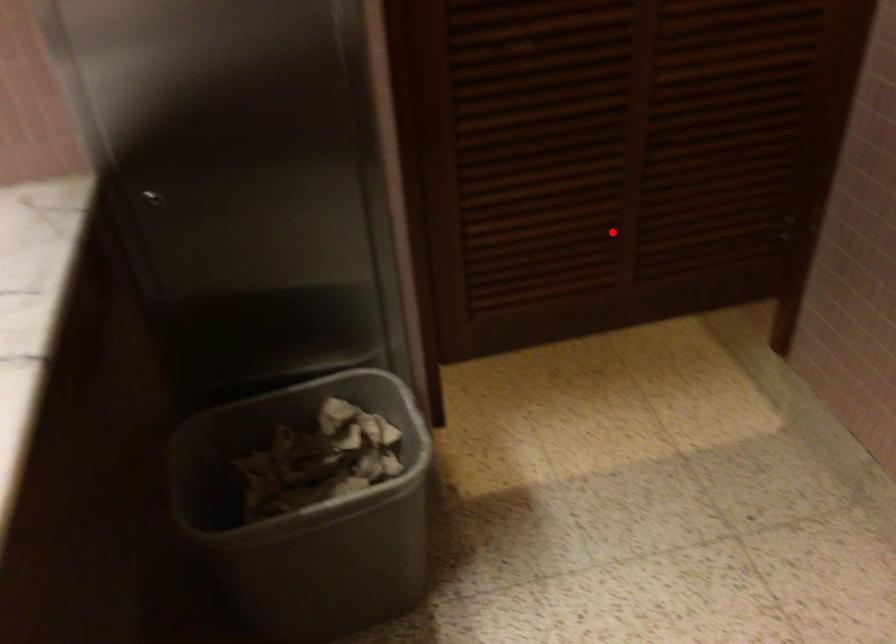
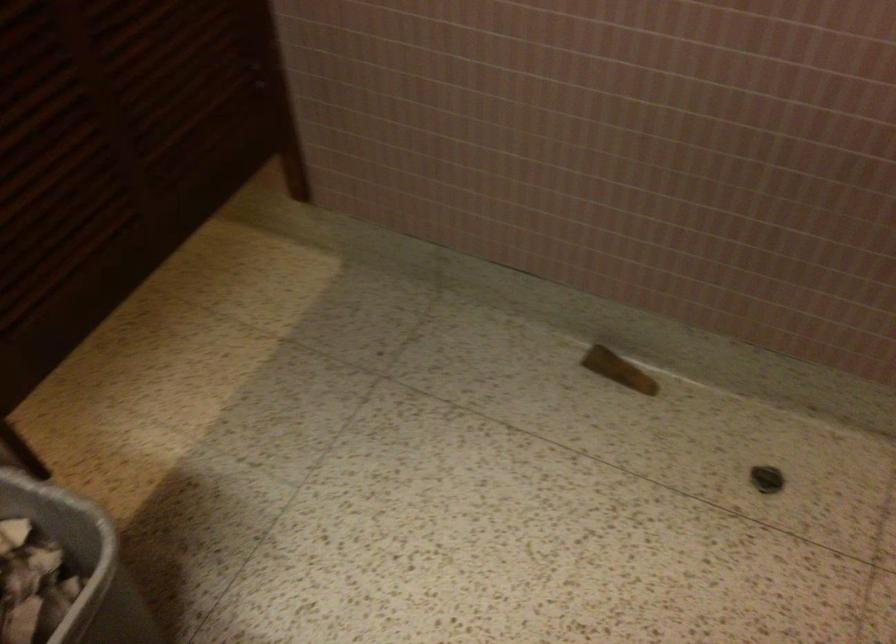
Question: I am providing you with two images of the same scene from different viewpoints. A red point is marked on the first image. At the location where the point appears in image 1, is it still visible in image 2?

Choices:
 (A) Yes
 (B) No

Answer: (A)